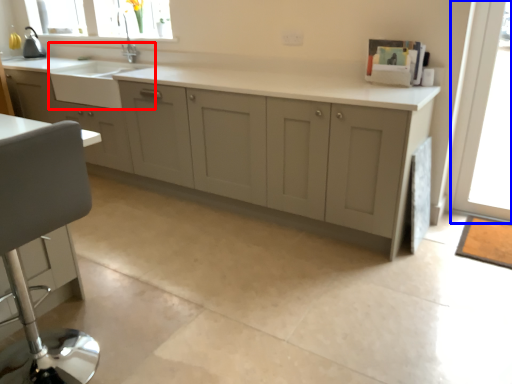
Question: Which point is closer to the camera, sink (highlighted by a red box) or window screen (highlighted by a blue box)?

Choices:
 (A) sink
 (B) window screen

Answer: (B)